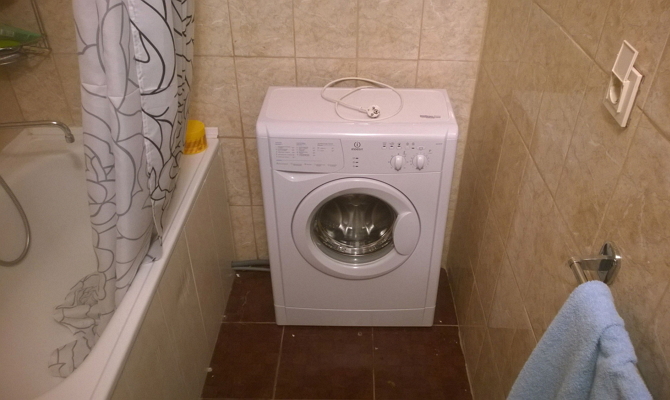
What are the coordinates of `brown tile floor` in the screenshot? It's located at (344, 370).